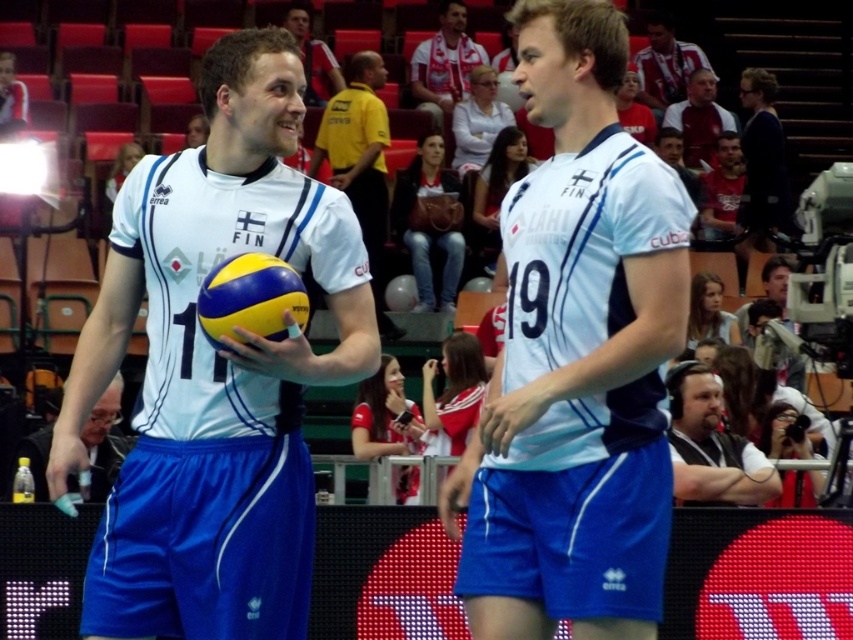
Question: Which of the following is the closest to the observer?

Choices:
 (A) matte white jersey at center
 (B) light brown hair at upper center

Answer: (B)

Question: Is white matte volleyball at center to the right of light brown hair at upper center from the viewer's perspective?

Choices:
 (A) no
 (B) yes

Answer: (A)

Question: In this image, where is white jersey at upper right located relative to matte gray shirt at upper right?

Choices:
 (A) above
 (B) below

Answer: (A)

Question: From the image, what is the correct spatial relationship of white fabric shirt at center in relation to dark brown leather jacket at lower right?

Choices:
 (A) below
 (B) above

Answer: (B)

Question: Among these points, which one is farthest from the camera?

Choices:
 (A) (585, 497)
 (B) (659, 83)

Answer: (B)

Question: Which of the following is the closest to the observer?

Choices:
 (A) (740, 483)
 (B) (451, 35)

Answer: (A)